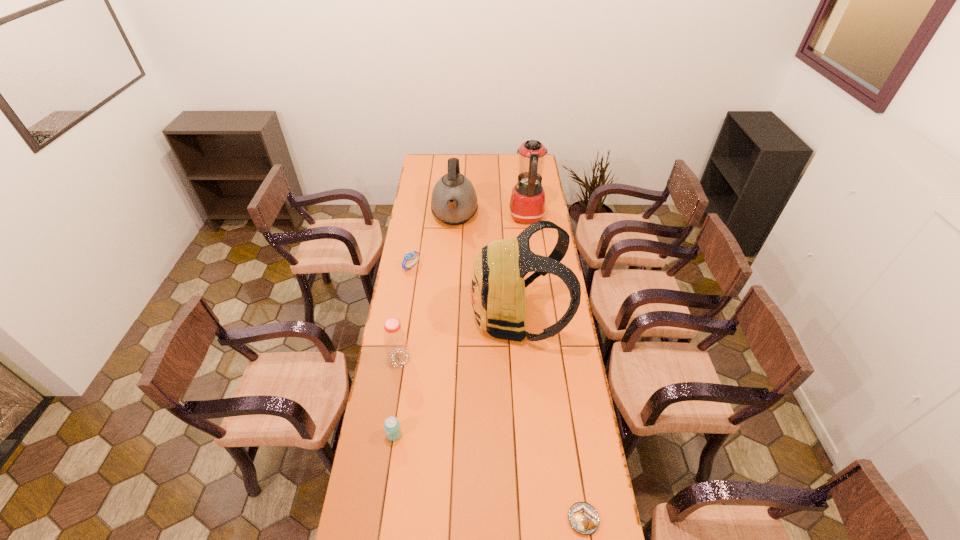
This screenshot has width=960, height=540. What are the coordinates of `vacant space at the far left corner of the desktop` in the screenshot? It's located at (422, 168).

At what (x,y) coordinates should I click in order to perform the action: click on free spot between the shortest object and the kettle. Please return your answer as a coordinate pair (x, y). This screenshot has height=540, width=960. Looking at the image, I should click on (518, 368).

At what (x,y) coordinates should I click in order to perform the action: click on vacant area between the fifth nearest object and the pastry. Please return your answer as a coordinate pair (x, y). Looking at the image, I should click on (497, 393).

What are the coordinates of `free area in between the sixth farthest object and the fourth tallest object` in the screenshot? It's located at (396, 396).

Find the location of `vacant area between the backpack and the fourth shortest object`. vacant area between the backpack and the fourth shortest object is located at coordinates (459, 338).

Locate an element on the screen. free space that is in between the fifth shortest object and the shortest object is located at coordinates (518, 368).

You are a GUI agent. You are given a task and a screenshot of the screen. Output one action in this format:
    pyautogui.click(x=<x>, y=<y>)
    Task: Click on the free space between the food processor and the shortest object
    The width and height of the screenshot is (960, 540).
    Given the screenshot: What is the action you would take?
    pyautogui.click(x=555, y=368)

Identify the location of vacant area that lies between the kettle and the second nearest object. Image resolution: width=960 pixels, height=540 pixels. [424, 325].

At what (x,y) coordinates should I click in order to perform the action: click on free space between the food processor and the pastry. Please return your answer as a coordinate pair (x, y). Looking at the image, I should click on (555, 368).

This screenshot has height=540, width=960. I want to click on empty location between the watch and the food processor, so click(469, 241).